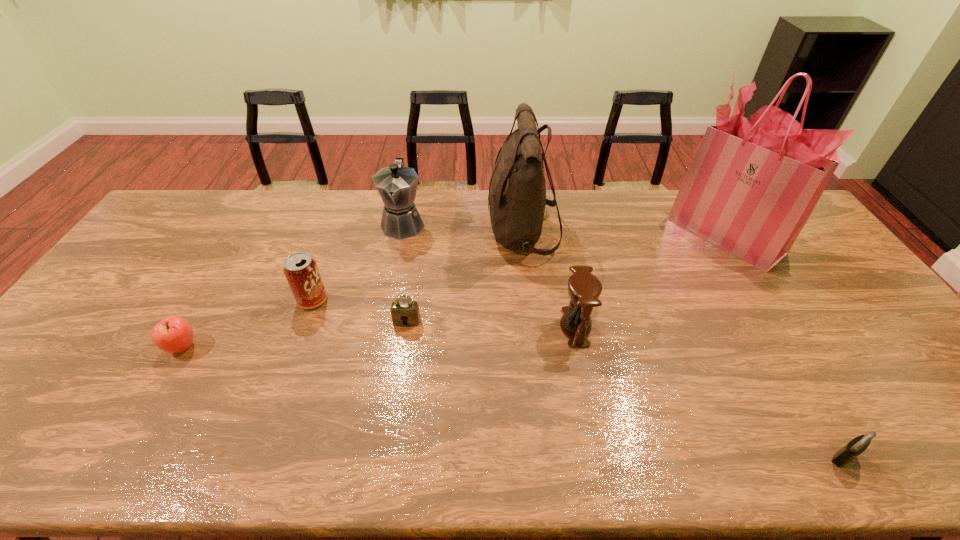
What are the coordinates of `backpack present at the far edge` in the screenshot? It's located at pos(517,191).

This screenshot has height=540, width=960. Identify the location of coffeepot that is at the far edge. (397, 185).

What are the coordinates of `object that is at the near edge` in the screenshot? It's located at (858, 445).

In order to click on object that is at the right edge in this screenshot , I will do `click(751, 187)`.

This screenshot has height=540, width=960. In order to click on object present at the far right corner in this screenshot , I will do `click(751, 187)`.

Where is `vacant space at the far edge`? The height and width of the screenshot is (540, 960). vacant space at the far edge is located at coordinates (320, 192).

In the image, there is a desktop. Identify the location of vacant space at the near edge. (x=155, y=461).

In the image, there is a desktop. Where is `vacant space at the left edge`? vacant space at the left edge is located at coordinates (177, 245).

At what (x,y) coordinates should I click in order to perform the action: click on free space at the right edge. Please return your answer as a coordinate pair (x, y). This screenshot has width=960, height=540. Looking at the image, I should click on (919, 420).

Find the location of a particular element. The width and height of the screenshot is (960, 540). vacant region between the farther padlock and the shopping bag is located at coordinates (565, 278).